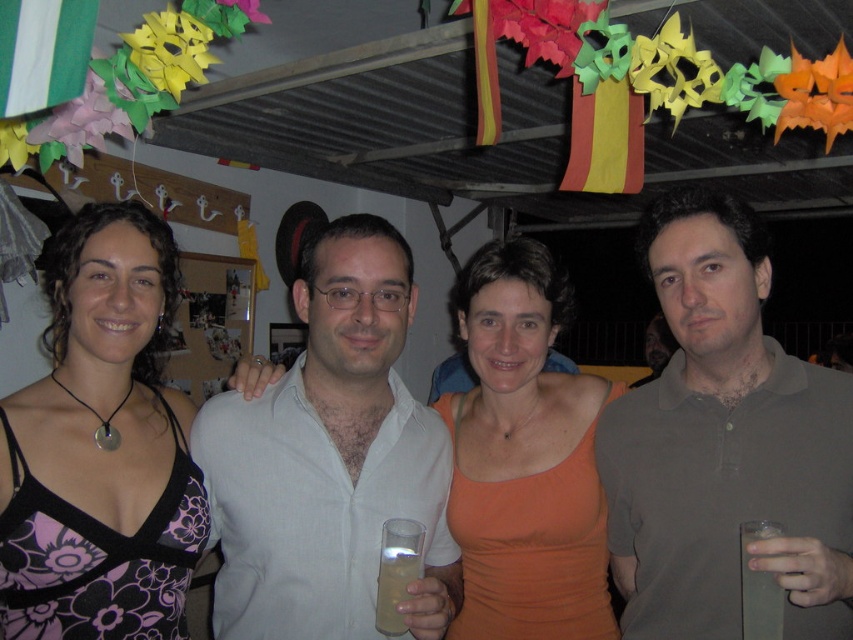
Is gray cotton polo shirt at right positioned before orange fabric tank top at center?

Yes, gray cotton polo shirt at right is closer to the viewer.

Between gray cotton polo shirt at right and orange fabric tank top at center, which one appears on the right side from the viewer's perspective?

Positioned to the right is gray cotton polo shirt at right.

Is point (724, 301) farther from viewer compared to point (474, 292)?

No, (724, 301) is in front of (474, 292).

At what (x,y) coordinates should I click in order to perform the action: click on gray cotton polo shirt at right. Please return your answer as a coordinate pair (x, y). The height and width of the screenshot is (640, 853). Looking at the image, I should click on (724, 444).

Does black floral dress at center have a lesser width compared to orange fabric tank top at center?

Incorrect, black floral dress at center's width is not less than orange fabric tank top at center's.

Between black floral dress at center and orange fabric tank top at center, which one has more height?

With more height is orange fabric tank top at center.

Find the location of a particular element. The height and width of the screenshot is (640, 853). black floral dress at center is located at coordinates (100, 448).

Can you confirm if black floral dress at center is thinner than clear glass at right?

Incorrect, black floral dress at center's width is not less than clear glass at right's.

Does black floral dress at center have a larger size compared to clear glass at right?

Indeed, black floral dress at center has a larger size compared to clear glass at right.

Is point (42, 621) less distant than point (741, 536)?

No, (42, 621) is behind (741, 536).

Locate an element on the screen. This screenshot has height=640, width=853. black floral dress at center is located at coordinates (100, 448).